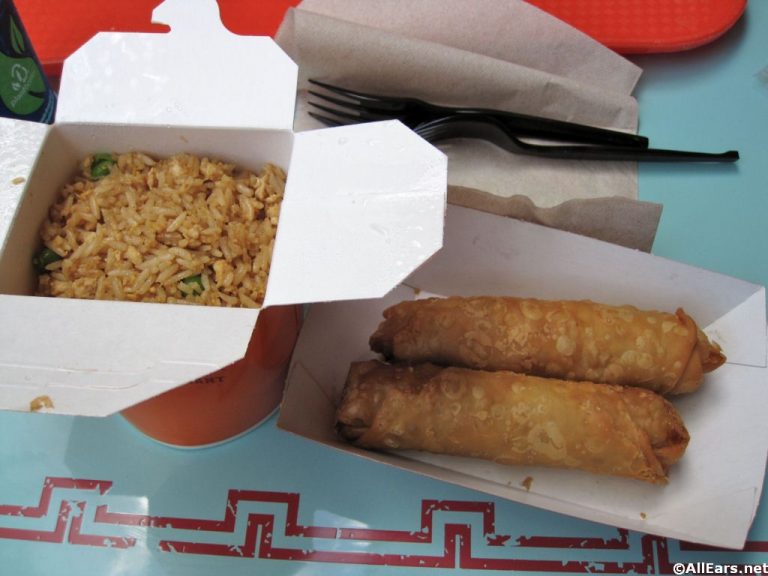
What are the coordinates of `napkins` in the screenshot? It's located at (434, 64), (485, 32), (528, 181).